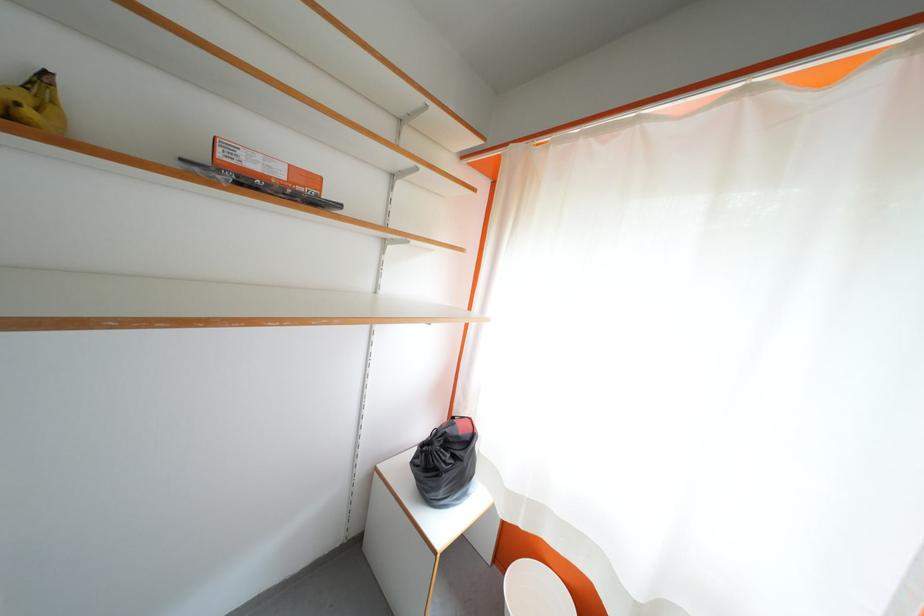
In order to click on black object in this screenshot , I will do `click(445, 463)`.